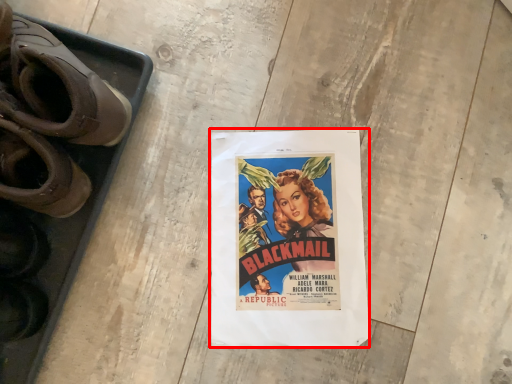
Question: From the image, what is the correct spatial relationship of poster (annotated by the red box) in relation to footwear?

Choices:
 (A) left
 (B) right

Answer: (B)